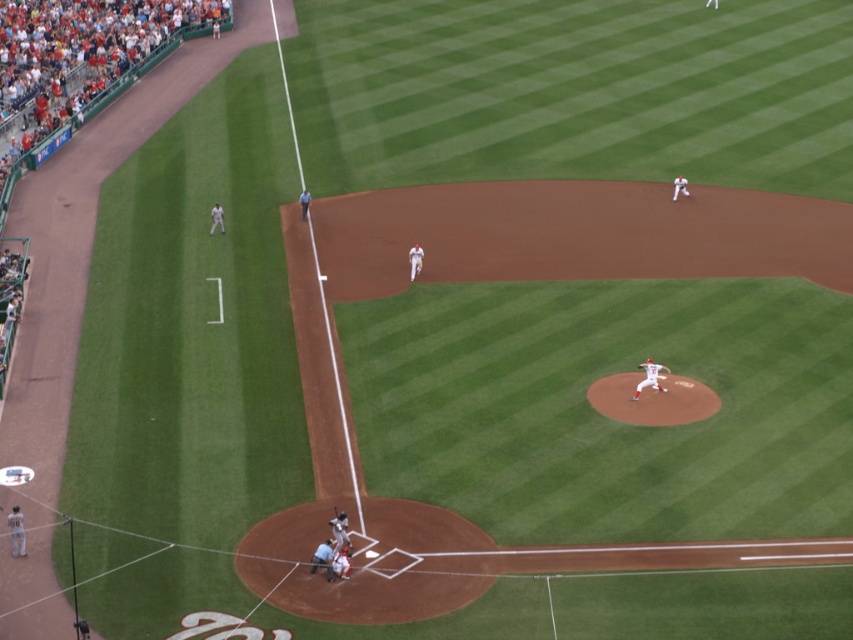
You are a spectator at the baseball game and want to take a photo of the wooden bat at home plate and the white fabric referee at lower center. Which object should you focus on first if you want to capture both in the same frame without moving the camera?

You should focus on the wooden bat at home plate first because the white fabric referee at lower center is to the left of it, so positioning the bat centrally would allow the referee to be included in the frame to the left side.

You are a drone operator trying to capture the best shot of the white matte baseball pitcher at center during the game. If you position your drone at the point with coordinates exactly halfway between the pitcher and the home plate, what would be the coordinates of this midpoint?

The coordinates of the midpoint between the white matte baseball pitcher at center and home plate would be calculated by averaging the pitcher coordinates and home plate coordinates. Since the pitcher is at point (648, 378) and home plate is at the origin point (0, 0), the midpoint coordinates would be (323, 188).

You are a photographer standing at the edge of the infield. You need to capture a closeup shot of the white fabric referee at lower center and the wooden bat at home plate. Which object should you zoom in on first to ensure it fits entirely within the frame?

The wooden bat at home plate should be zoomed in on first because the white fabric referee at lower center is wider, so focusing on the smaller object ensures it fits before adjusting for the larger one.